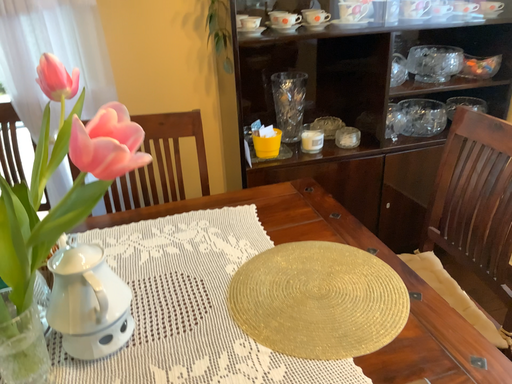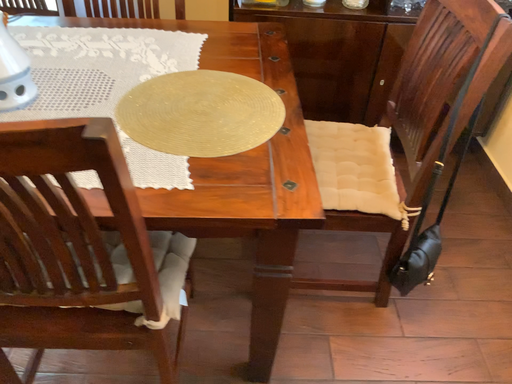
Question: Which way did the camera rotate in the video?

Choices:
 (A) rotated left
 (B) rotated right

Answer: (A)